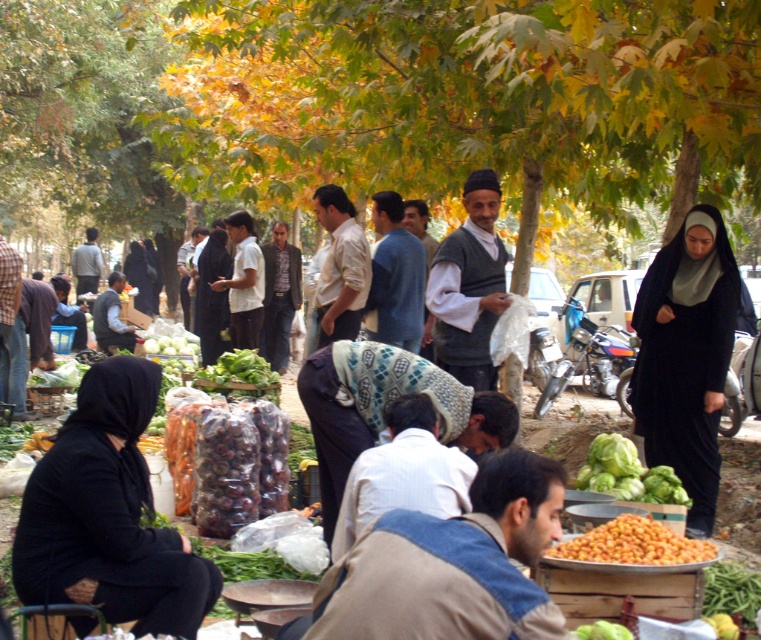
Question: Does orange matte fruit at lower right appear over green leafy at center?

Choices:
 (A) no
 (B) yes

Answer: (A)

Question: Among these points, which one is farthest from the camera?

Choices:
 (A) (180, 541)
 (B) (594, 547)

Answer: (A)

Question: Which object is the closest to the black fabric headscarf at lower left?

Choices:
 (A) orange matte fruit at lower right
 (B) green leafy vegetable at lower center
 (C) green leafy at center

Answer: (A)

Question: Does black fabric headscarf at lower left have a larger size compared to green leafy vegetable at lower center?

Choices:
 (A) no
 (B) yes

Answer: (B)

Question: Estimate the real-world distances between objects in this image. Which object is farther from the orange matte fruit at lower right?

Choices:
 (A) green leafy at center
 (B) black fabric headscarf at lower left
 (C) green leafy vegetables at center

Answer: (A)

Question: Is green leafy vegetables at center below green leafy at center?

Choices:
 (A) no
 (B) yes

Answer: (B)